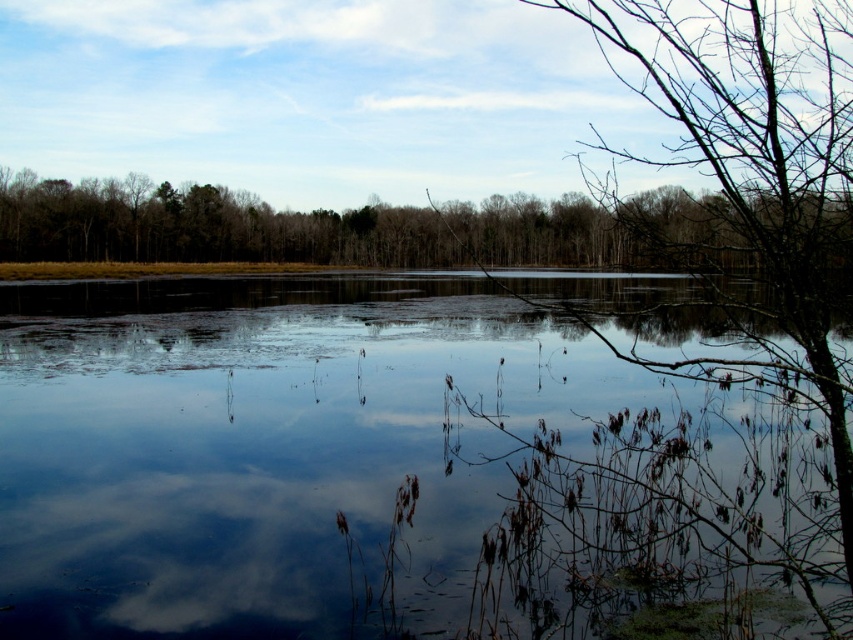
You are standing at the edge of the lake and see the transparent water at center and the green leafy tree at right. Which object appears taller from your viewpoint?

The green leafy tree at right appears taller than the transparent water at center because the description states that the transparent water at center has a lesser height compared to the green leafy tree at right.

You are an artist planning to paint the scene. You need to decide which area to focus on first based on their widths. Which object should you paint first, the transparent water at center or the green matte trees at upper center?

The transparent water at center is thinner than the green matte trees at upper center, so you should paint the green matte trees at upper center first as they are wider and form the background structure.

You are standing at the center of the image and looking towards the green leafy tree at right. Which direction should you turn to face the point at coordinates point [759,168]?

The point at coordinates point [759,168] is on the green leafy tree at right, so you should turn to your right to face it.